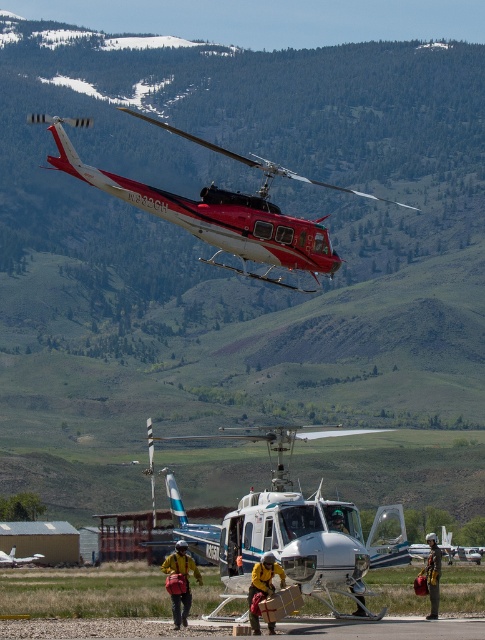
You are a drone operator trying to capture a photo of the airfield. Your drone can only fly up to 35 meters away from you. There is a specific point at coordinates point (183, 577) that you want to focus on. Will your drone be able to reach that point?

The distance of point (183, 577) from camera is 36.20 meters, so the drone cannot reach that point since it exceeds the maximum range of 35 meters.

You are a pilot observing the scene from the airfield. You need to determine which object is bigger between the metallic red helicopter at upper center and the yellow fabric jacket at center. Which one is bigger?

The metallic red helicopter at upper center is larger in size compared to the yellow fabric jacket at center.